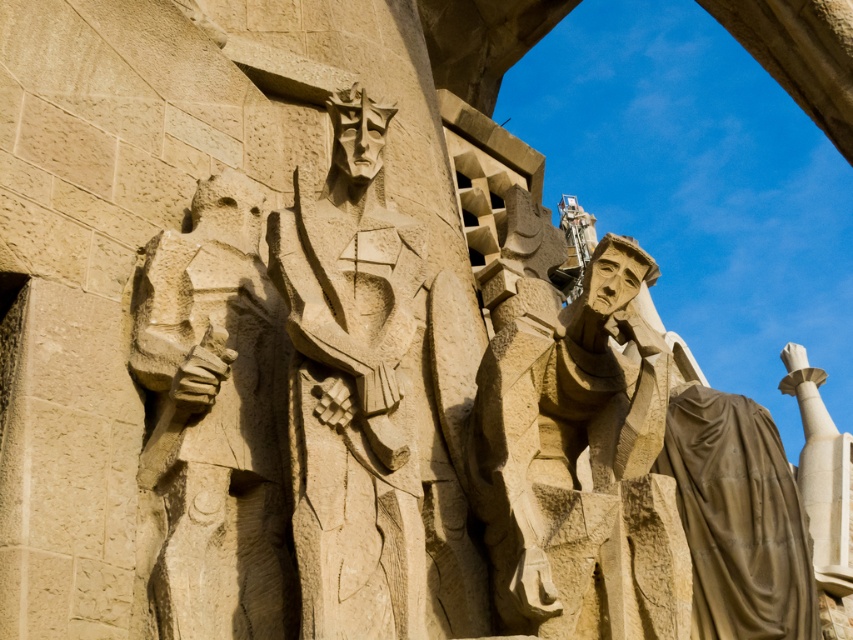
Question: Is beige stone sculpture at center positioned at the back of carved stone figure at center?

Choices:
 (A) no
 (B) yes

Answer: (A)

Question: Which of the following is the farthest from the observer?

Choices:
 (A) coord(386,291)
 (B) coord(251,428)

Answer: (B)

Question: Can you confirm if beige stone sculpture at center is smaller than carved stone figure at center?

Choices:
 (A) no
 (B) yes

Answer: (A)

Question: Considering the relative positions of beige stone sculpture at center and carved stone figure at center in the image provided, where is beige stone sculpture at center located with respect to carved stone figure at center?

Choices:
 (A) left
 (B) right

Answer: (B)